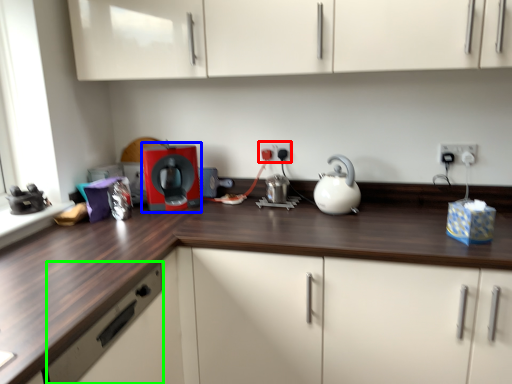
Question: Considering the real-world distances, which object is farthest from electric outlet (highlighted by a red box)? home appliance (highlighted by a blue box) or drawer (highlighted by a green box)?

Choices:
 (A) home appliance
 (B) drawer

Answer: (B)